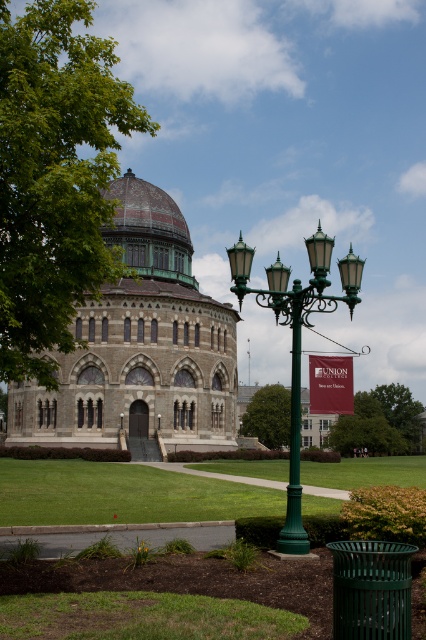
Question: Can you confirm if green metal street light at center is positioned to the left of green metal pole at center?

Choices:
 (A) no
 (B) yes

Answer: (A)

Question: Among these points, which one is farthest from the camera?

Choices:
 (A) 287,493
 (B) 259,394
 (C) 416,433

Answer: (C)

Question: Which object is farther from the camera taking this photo?

Choices:
 (A) green metal street light at center
 (B) green leafy tree at center
 (C) green leafy tree at upper left
 (D) green leafy tree at lower center

Answer: (D)

Question: Which object is positioned closest to the green leafy tree at upper left?

Choices:
 (A) green metal street light at center
 (B) green leafy tree at lower center

Answer: (A)

Question: Is green leafy tree at lower center closer to camera compared to maroon fabric banner at center?

Choices:
 (A) no
 (B) yes

Answer: (A)

Question: Is green leafy tree at lower center below green metal pole at center?

Choices:
 (A) no
 (B) yes

Answer: (B)